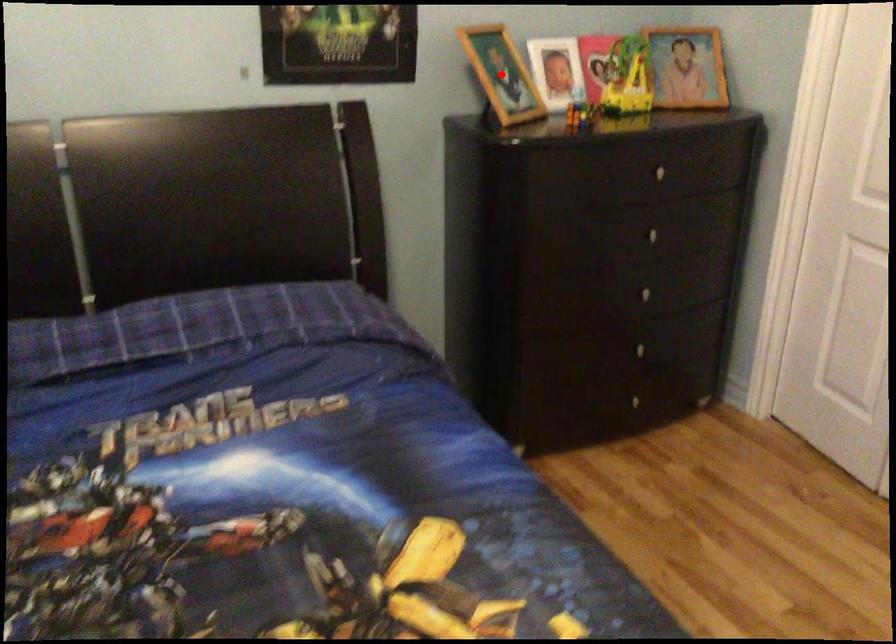
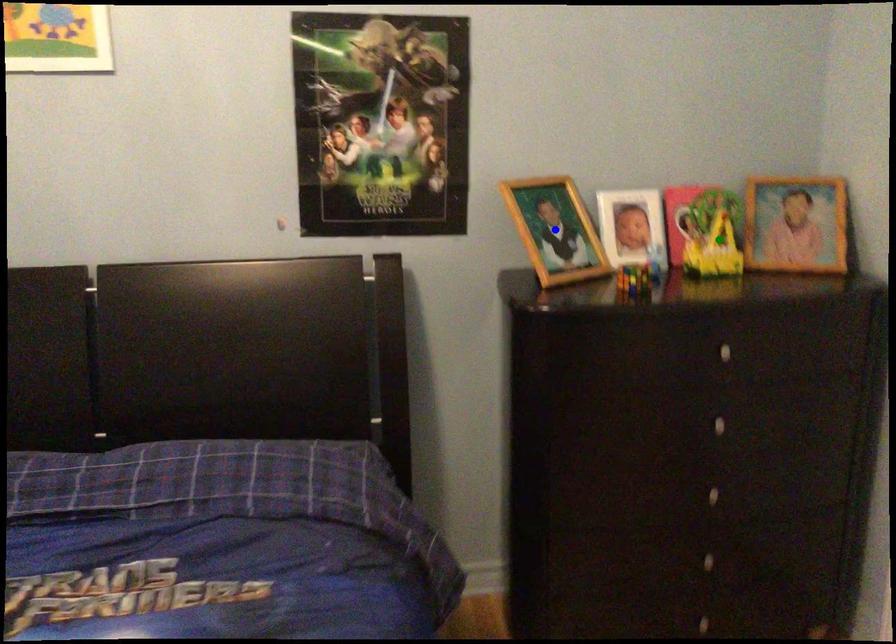
Question: I am providing you with two images of the same scene from different viewpoints. A red point is marked on the first image. You are given multiple points on the second image. Which mark in image 2 goes with the point in image 1?

Choices:
 (A) yellow point
 (B) blue point
 (C) green point

Answer: (B)